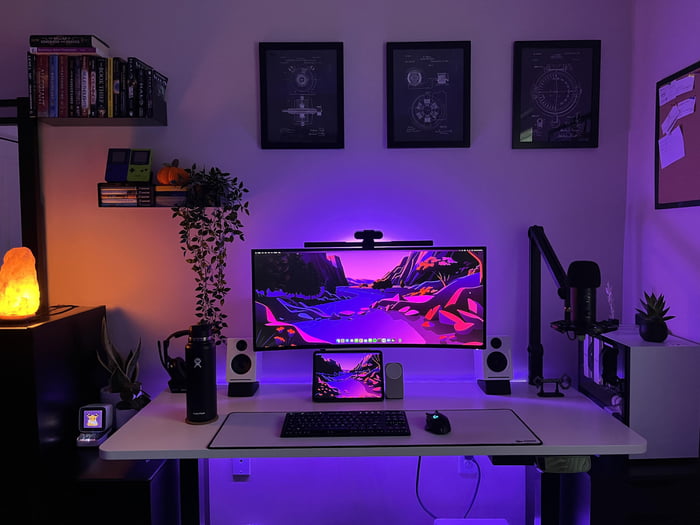
Find the location of `pinned papers`. pinned papers is located at coordinates (673, 146), (670, 114), (682, 112), (682, 92), (668, 92).